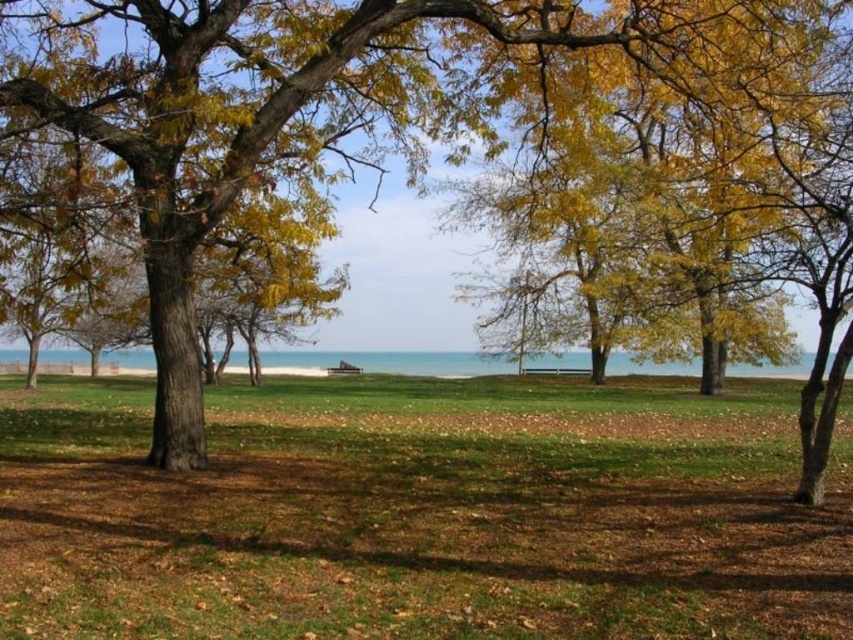
Who is more forward, (173, 97) or (418, 358)?

Point (173, 97) is in front.

Is yellow leafy tree at center further to camera compared to blue water at center?

Yes, yellow leafy tree at center is behind blue water at center.

Is point (732, 33) closer to camera compared to point (570, 365)?

Yes.

You are a GUI agent. You are given a task and a screenshot of the screen. Output one action in this format:
    pyautogui.click(x=<x>, y=<y>)
    Task: Click on the yellow leafy tree at center
    
    Given the screenshot: What is the action you would take?
    pyautogui.click(x=322, y=100)